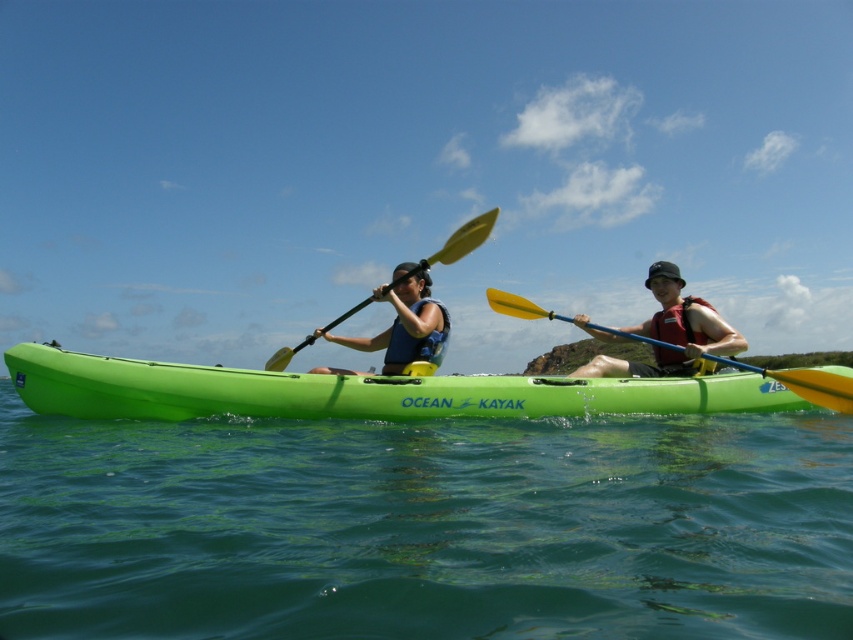
You are a safety inspector checking the equipment of the kayakers. You need to ensure that the life vest can fit over the paddle for storage. Based on the image, will the matte blue life vest at center fit over the yellow matte paddle at center?

The matte blue life vest at center has a lesser width compared to the yellow matte paddle at center, so it cannot fit over the paddle since the paddle is wider.

You are a safety inspector checking the positioning of the life vests relative to the kayak. According to the image, is the matte blue life vest at center positioned to the left or right of the green plastic kayak at center?

The green plastic kayak at center is to the right of the matte blue life vest at center, so the matte blue life vest at center is positioned to the left of the green plastic kayak at center.